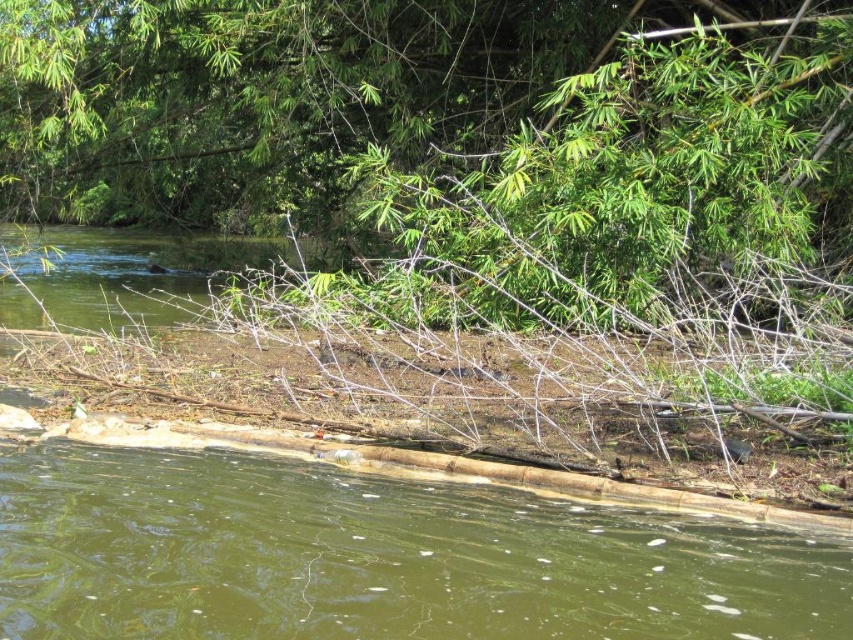
You are standing at the origin point of the coordinate system, which is the bottom left corner of the image. You want to place a new object at the same location as the brown wood log at lower center. What are the coordinates where you should place it?

The coordinates for the brown wood log at lower center are at point (378,557). So you should place the new object at coordinates (378,557).

You are a park ranger assessing the riverside area. You see a green leafy tree at upper center and a green leafy water at center. Which object takes up more space in the scene?

The green leafy tree at upper center is larger in size than the green leafy water at center, so it takes up more space in the scene.

You are a kayaker planning to navigate through the river. You see the brown wood log at lower center and the green leafy water at center. Which object is shorter in height?

The brown wood log at lower center is shorter than the green leafy water at center.